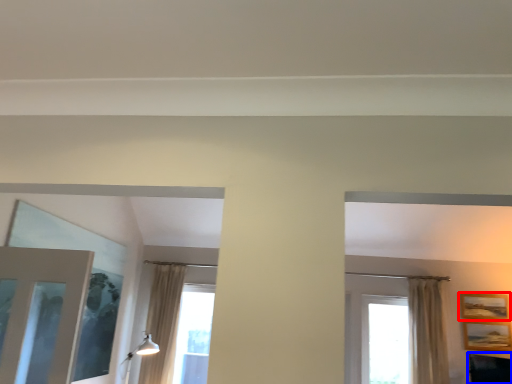
Question: Among these objects, which one is nearest to the camera, picture frame (highlighted by a red box) or furniture (highlighted by a blue box)?

Choices:
 (A) picture frame
 (B) furniture

Answer: (B)